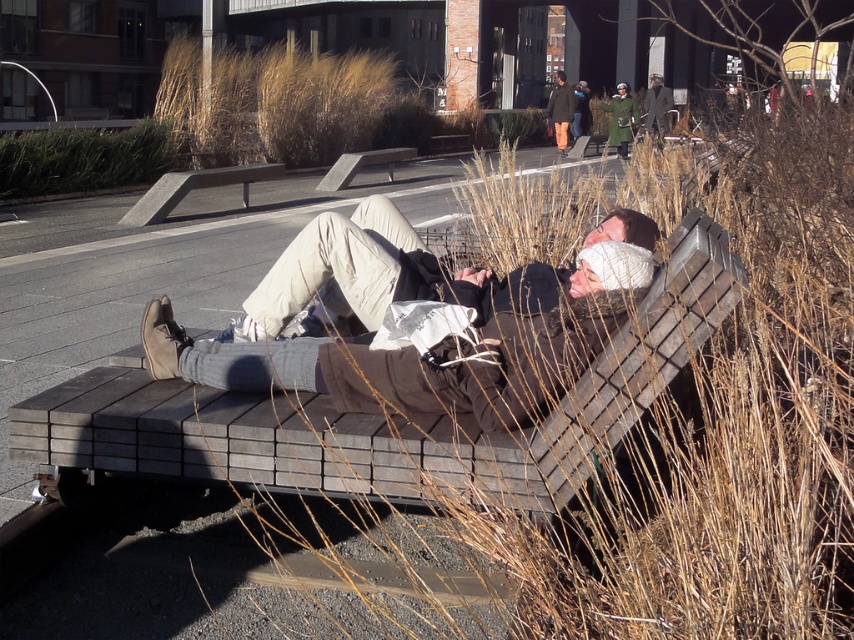
Question: Based on their relative distances, which object is nearer to the wooden bench at center?

Choices:
 (A) green wool coat at center
 (B) matte khaki pants at center

Answer: (B)

Question: Does matte khaki pants at center have a smaller size compared to smooth gray bench at center?

Choices:
 (A) no
 (B) yes

Answer: (B)

Question: Is matte khaki pants at center positioned before dark brown leather coat at upper center?

Choices:
 (A) no
 (B) yes

Answer: (B)

Question: Is wooden bench at center behind smooth gray bench at center?

Choices:
 (A) yes
 (B) no

Answer: (B)

Question: Which point is farther to the camera?

Choices:
 (A) (241, 195)
 (B) (557, 80)
 (C) (340, 163)
 (D) (604, 272)

Answer: (B)

Question: Which object appears closest to the camera in this image?

Choices:
 (A) wooden bench at center
 (B) wooden park bench at center
 (C) matte khaki pants at center
 (D) dark brown leather coat at upper center

Answer: (A)